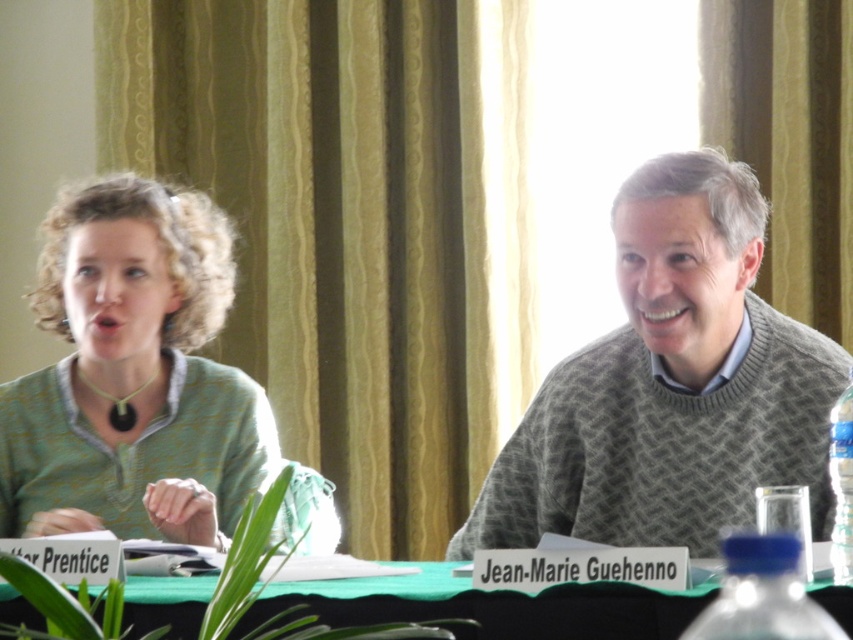
Question: Among these points, which one is farthest from the camera?

Choices:
 (A) [108, 380]
 (B) [706, 634]
 (C) [715, 499]
 (D) [412, 593]

Answer: (A)

Question: Among these objects, which one is nearest to the camera?

Choices:
 (A) gray knitted sweater at center
 (B) clear plastic bottle at right

Answer: (B)

Question: Is gray knitted sweater at center positioned in front of green fabric table at center?

Choices:
 (A) yes
 (B) no

Answer: (B)

Question: Among these objects, which one is farthest from the camera?

Choices:
 (A) green fabric table at center
 (B) blue plastic bottle at lower right

Answer: (A)

Question: Is green knitted sweater at upper center closer to the viewer compared to clear plastic bottle at right?

Choices:
 (A) no
 (B) yes

Answer: (A)

Question: Does green knitted sweater at upper center come in front of gray knitted sweater at center?

Choices:
 (A) yes
 (B) no

Answer: (A)